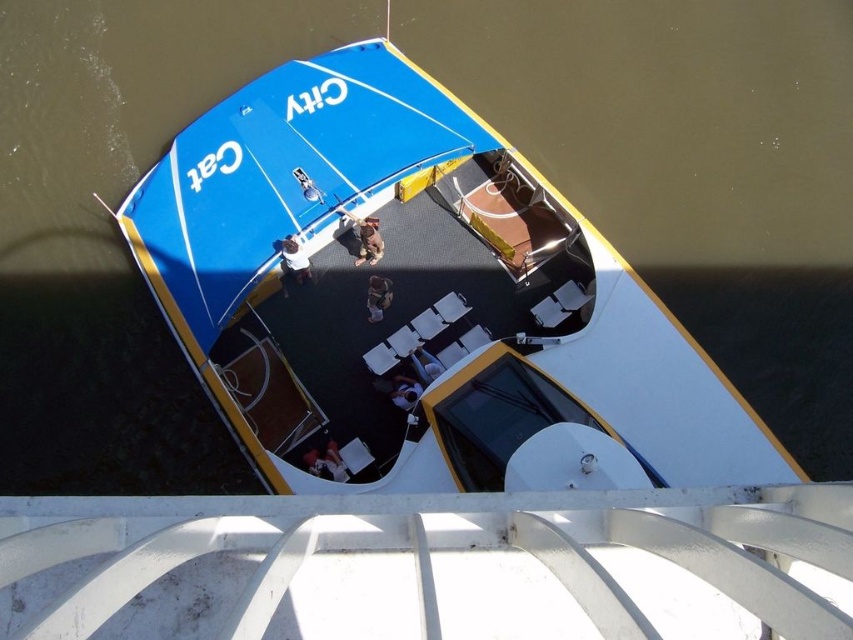
The width and height of the screenshot is (853, 640). What do you see at coordinates (402, 307) in the screenshot?
I see `white plastic chairs at center` at bounding box center [402, 307].

Between white plastic chairs at center and white fabric bag at center, which one appears on the right side from the viewer's perspective?

white plastic chairs at center

Is point (495, 202) more distant than point (303, 252)?

Yes, point (495, 202) is behind point (303, 252).

This screenshot has width=853, height=640. I want to click on white plastic chairs at center, so click(x=402, y=307).

Between point (352, 372) and point (425, 358), which one is positioned in front?

Point (425, 358) is more forward.

Is white plastic chairs at center shorter than white fabric shirt at center?

No, white plastic chairs at center is not shorter than white fabric shirt at center.

The width and height of the screenshot is (853, 640). What are the coordinates of `white plastic chairs at center` in the screenshot? It's located at (402, 307).

Who is taller, white fabric bag at center or white fabric shirt at center?

white fabric bag at center

Between white fabric bag at center and white fabric shirt at center, which one appears on the right side from the viewer's perspective?

Positioned to the right is white fabric shirt at center.

The width and height of the screenshot is (853, 640). Find the location of `white fabric bag at center`. white fabric bag at center is located at coordinates (294, 259).